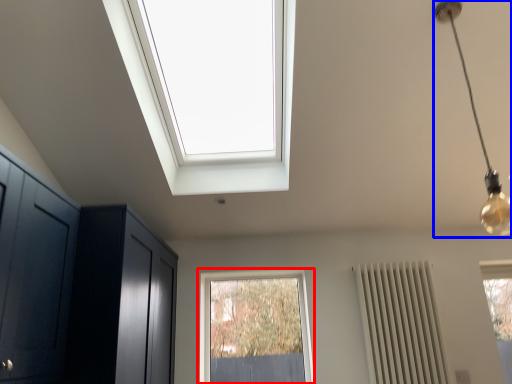
Question: Which point is closer to the camera, window (highlighted by a red box) or light fixture (highlighted by a blue box)?

Choices:
 (A) window
 (B) light fixture

Answer: (B)